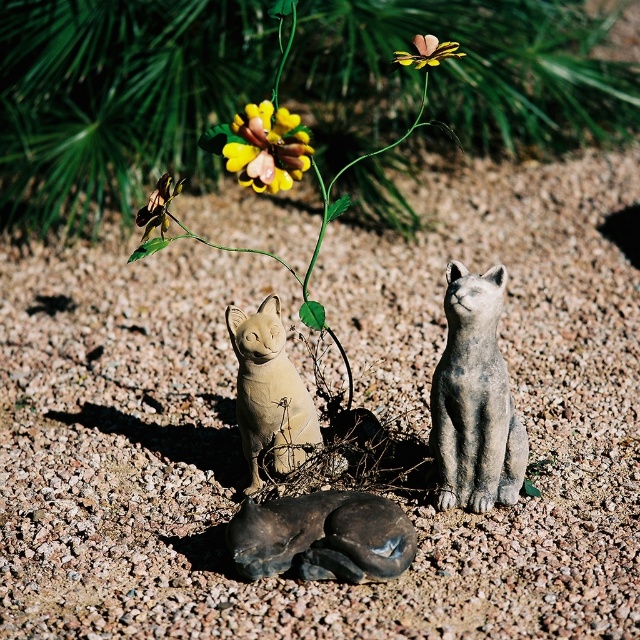
Question: Among these points, which one is farthest from the camera?

Choices:
 (A) (468, 328)
 (B) (186, 17)
 (C) (264, 433)
 (D) (256, 179)

Answer: (B)

Question: Which object is farther from the camera taking this photo?

Choices:
 (A) matte stone cat at center
 (B) gray stone cat at center
 (C) yellow matte flower at upper center

Answer: (C)

Question: Can you confirm if matte yellow flower at center is bigger than yellow matte flower at center?

Choices:
 (A) no
 (B) yes

Answer: (B)

Question: Among these points, which one is nearest to the camera?

Choices:
 (A) (182, 80)
 (B) (490, 288)
 (C) (241, 426)

Answer: (B)

Question: Can you confirm if matte yellow flower at center is wider than yellow matte flower at center?

Choices:
 (A) yes
 (B) no

Answer: (A)

Question: Can you confirm if matte yellow flower at center is positioned above yellow matte flower at center?

Choices:
 (A) yes
 (B) no

Answer: (A)